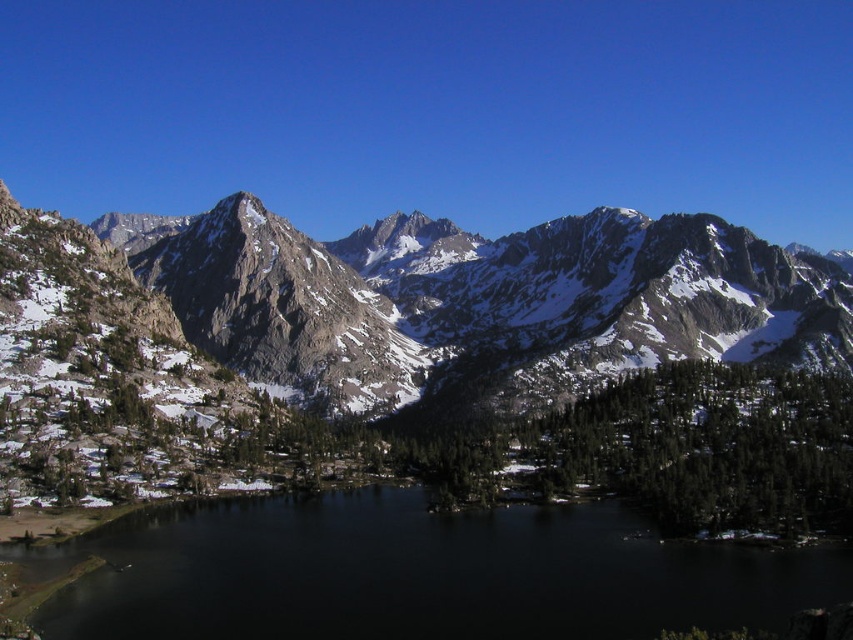
Question: From the image, what is the correct spatial relationship of rocky gray mountain range at center in relation to black water at center?

Choices:
 (A) right
 (B) left

Answer: (B)

Question: Is rocky gray mountain range at center bigger than black water at center?

Choices:
 (A) yes
 (B) no

Answer: (A)

Question: Which point is closer to the camera taking this photo?

Choices:
 (A) (291, 330)
 (B) (695, 541)

Answer: (B)

Question: Which of the following is the closest to the observer?

Choices:
 (A) (799, 588)
 (B) (355, 291)

Answer: (A)

Question: Which point is farther from the camera taking this photo?

Choices:
 (A) (693, 611)
 (B) (398, 273)

Answer: (B)

Question: Is rocky gray mountain range at center positioned before black water at center?

Choices:
 (A) yes
 (B) no

Answer: (B)